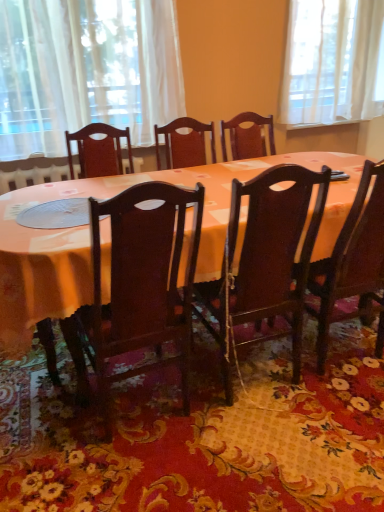
This screenshot has height=512, width=384. What are the coordinates of `dark wood chair at right, which is counted as the first chair, starting from the right` in the screenshot? It's located at (354, 264).

This screenshot has width=384, height=512. Describe the element at coordinates (85, 70) in the screenshot. I see `white sheer curtain at upper left` at that location.

What is the approximate width of orange fabric mat at center?

→ It is 5.41 feet.

What is the approximate width of dark wood chair at center, the 3th chair when ordered from right to left?

dark wood chair at center, the 3th chair when ordered from right to left, is 42.03 centimeters wide.

Identify the location of matte wood table at center. The height and width of the screenshot is (512, 384). (89, 236).

This screenshot has width=384, height=512. Identify the location of dark wood chair at right, which appears as the 3th chair when viewed from the left. (x=354, y=264).

Is white sheer curtain at upper left completely or partially outside of dark wood chair at center, marked as the second chair in a left-to-right arrangement?

Indeed, white sheer curtain at upper left is completely outside dark wood chair at center, marked as the second chair in a left-to-right arrangement.

Considering the positions of objects white sheer curtain at upper left and dark wood chair at center, acting as the second chair starting from the right, in the image provided, who is more to the left, white sheer curtain at upper left or dark wood chair at center, acting as the second chair starting from the right,?

From the viewer's perspective, white sheer curtain at upper left appears more on the left side.

Looking at this image, in the image, is white sheer curtain at upper left positioned in front of or behind dark wood chair at center, acting as the second chair starting from the right?

In the image, white sheer curtain at upper left appears behind dark wood chair at center, acting as the second chair starting from the right.

Consider the image. From a real-world perspective, is white sheer curtain at upper left physically located above or below dark wood chair at center, acting as the second chair starting from the right?

white sheer curtain at upper left is situated higher than dark wood chair at center, acting as the second chair starting from the right, in the real world.

Is dark wood chair at center, marked as the second chair in a left-to-right arrangement, aimed at white sheer curtain at upper left?

Yes, dark wood chair at center, marked as the second chair in a left-to-right arrangement, faces towards white sheer curtain at upper left.

Visually, is dark wood chair at center, marked as the second chair in a left-to-right arrangement, positioned to the left or to the right of white sheer curtain at upper left?

dark wood chair at center, marked as the second chair in a left-to-right arrangement, is to the right of white sheer curtain at upper left.

Which of these two, dark wood chair at center, marked as the second chair in a left-to-right arrangement, or white sheer curtain at upper left, stands taller?

Standing taller between the two is dark wood chair at center, marked as the second chair in a left-to-right arrangement.

Is dark wood chair at center, marked as the second chair in a left-to-right arrangement, far from white sheer curtain at upper left?

Yes, dark wood chair at center, marked as the second chair in a left-to-right arrangement, and white sheer curtain at upper left are located far from each other.

From a real-world perspective, is dark wood chair at right, which appears as the 3th chair when viewed from the left, located higher than dark wood chair at center, placed as the 1th chair when sorted from left to right?

Yes.

Does point (380, 231) lie in front of point (152, 192)?

That is False.

Which object is further away from the camera, dark wood chair at right, which appears as the 3th chair when viewed from the left, or dark wood chair at center, placed as the 1th chair when sorted from left to right?

dark wood chair at right, which appears as the 3th chair when viewed from the left, is more distant.

Would you say dark wood chair at right, which appears as the 3th chair when viewed from the left, is to the left or to the right of dark wood chair at center, the 3th chair when ordered from right to left, in the picture?

dark wood chair at right, which appears as the 3th chair when viewed from the left, is to the right of dark wood chair at center, the 3th chair when ordered from right to left.

Looking at this image, considering the sizes of dark wood chair at right, which appears as the 3th chair when viewed from the left, and white sheer curtain at upper left in the image, is dark wood chair at right, which appears as the 3th chair when viewed from the left, bigger or smaller than white sheer curtain at upper left?

Considering their sizes, dark wood chair at right, which appears as the 3th chair when viewed from the left, takes up more space than white sheer curtain at upper left.

From the image's perspective, is dark wood chair at right, which appears as the 3th chair when viewed from the left, over white sheer curtain at upper left?

No.

Is dark wood chair at right, which is counted as the first chair, starting from the right, taller or shorter than white sheer curtain at upper left?

Considering their sizes, dark wood chair at right, which is counted as the first chair, starting from the right, has more height than white sheer curtain at upper left.

How many degrees apart are the facing directions of dark wood chair at right, which appears as the 3th chair when viewed from the left, and white sheer curtain at upper left?

The facing directions of dark wood chair at right, which appears as the 3th chair when viewed from the left, and white sheer curtain at upper left are 180 degrees apart.

How much distance is there between dark wood chair at right, which is counted as the first chair, starting from the right, and matte wood table at center?

22.07 inches.

Can you confirm if dark wood chair at right, which is counted as the first chair, starting from the right, is smaller than matte wood table at center?

Indeed, dark wood chair at right, which is counted as the first chair, starting from the right, has a smaller size compared to matte wood table at center.

Is dark wood chair at right, which is counted as the first chair, starting from the right, thinner than matte wood table at center?

Yes.

Identify the location of the 2nd chair to the right when counting from the matte wood table at center. The image size is (384, 512). (354, 264).

Does white sheer curtain at upper left have a lesser height compared to orange fabric mat at center?

Incorrect, the height of white sheer curtain at upper left does not fall short of that of orange fabric mat at center.

Is white sheer curtain at upper left bigger or smaller than orange fabric mat at center?

white sheer curtain at upper left is bigger than orange fabric mat at center.

Is white sheer curtain at upper left surrounding orange fabric mat at center?

No, white sheer curtain at upper left does not contain orange fabric mat at center.

Is white sheer curtain at upper left far away from orange fabric mat at center?

Yes, white sheer curtain at upper left is far from orange fabric mat at center.

From a real-world perspective, is white sheer curtain at upper left over dark wood chair at right, which appears as the 3th chair when viewed from the left?

Yes, from a real-world perspective, white sheer curtain at upper left is above dark wood chair at right, which appears as the 3th chair when viewed from the left.

Is the surface of white sheer curtain at upper left in direct contact with dark wood chair at right, which is counted as the first chair, starting from the right?

There is a gap between white sheer curtain at upper left and dark wood chair at right, which is counted as the first chair, starting from the right.

Which is more to the right, white sheer curtain at upper left or dark wood chair at right, which appears as the 3th chair when viewed from the left?

dark wood chair at right, which appears as the 3th chair when viewed from the left.

Considering the relative sizes of white sheer curtain at upper left and dark wood chair at right, which is counted as the first chair, starting from the right, in the image provided, is white sheer curtain at upper left wider than dark wood chair at right, which is counted as the first chair, starting from the right,?

Incorrect, the width of white sheer curtain at upper left does not surpass that of dark wood chair at right, which is counted as the first chair, starting from the right.

I want to click on curtain above the dark wood chair at center, marked as the second chair in a left-to-right arrangement (from the image's perspective), so click(85, 70).

Image resolution: width=384 pixels, height=512 pixels. Identify the location of curtain located on the left of dark wood chair at center, marked as the second chair in a left-to-right arrangement. (85, 70).

Which object lies further to the anchor point matte wood table at center, orange fabric mat at center or dark wood chair at right, which is counted as the first chair, starting from the right?

The object further to matte wood table at center is orange fabric mat at center.

Which object lies nearer to the anchor point dark wood chair at right, which appears as the 3th chair when viewed from the left, orange fabric mat at center or white sheer curtain at upper left?

orange fabric mat at center is closer to dark wood chair at right, which appears as the 3th chair when viewed from the left.

Consider the image. From the image, which object appears to be farther from dark wood chair at center, marked as the second chair in a left-to-right arrangement, matte wood table at center or dark wood chair at right, which appears as the 3th chair when viewed from the left?

matte wood table at center is positioned further to the anchor dark wood chair at center, marked as the second chair in a left-to-right arrangement.

Estimate the real-world distances between objects in this image. Which object is further from dark wood chair at center, acting as the second chair starting from the right, dark wood chair at center, the 3th chair when ordered from right to left, or matte wood table at center?

The object further to dark wood chair at center, acting as the second chair starting from the right, is matte wood table at center.

From the image, which object appears to be farther from matte wood table at center, dark wood chair at center, the 3th chair when ordered from right to left, or dark wood chair at center, acting as the second chair starting from the right?

The object further to matte wood table at center is dark wood chair at center, acting as the second chair starting from the right.

Based on their spatial positions, is dark wood chair at center, acting as the second chair starting from the right, or dark wood chair at center, the 3th chair when ordered from right to left, closer to dark wood chair at right, which appears as the 3th chair when viewed from the left?

Based on the image, dark wood chair at center, acting as the second chair starting from the right, appears to be nearer to dark wood chair at right, which appears as the 3th chair when viewed from the left.

When comparing their distances from white sheer curtain at upper left, does orange fabric mat at center or matte wood table at center seem closer?

Among the two, matte wood table at center is located nearer to white sheer curtain at upper left.

Which object lies nearer to the anchor point dark wood chair at right, which is counted as the first chair, starting from the right, dark wood chair at center, marked as the second chair in a left-to-right arrangement, or white sheer curtain at upper left?

dark wood chair at center, marked as the second chair in a left-to-right arrangement, lies closer to dark wood chair at right, which is counted as the first chair, starting from the right, than the other object.

Identify the location of desk located between dark wood chair at center, placed as the 1th chair when sorted from left to right, and dark wood chair at center, acting as the second chair starting from the right, in the left-right direction. This screenshot has width=384, height=512. (89, 236).

Locate an element on the screen. The width and height of the screenshot is (384, 512). desk located between white sheer curtain at upper left and dark wood chair at right, which is counted as the first chair, starting from the right, in the left-right direction is located at coordinates (89, 236).

This screenshot has height=512, width=384. I want to click on chair between matte wood table at center and dark wood chair at right, which appears as the 3th chair when viewed from the left, so click(x=265, y=260).

The height and width of the screenshot is (512, 384). What are the coordinates of `chair located between dark wood chair at center, the 3th chair when ordered from right to left, and orange fabric mat at center in the left-right direction` in the screenshot? It's located at (265, 260).